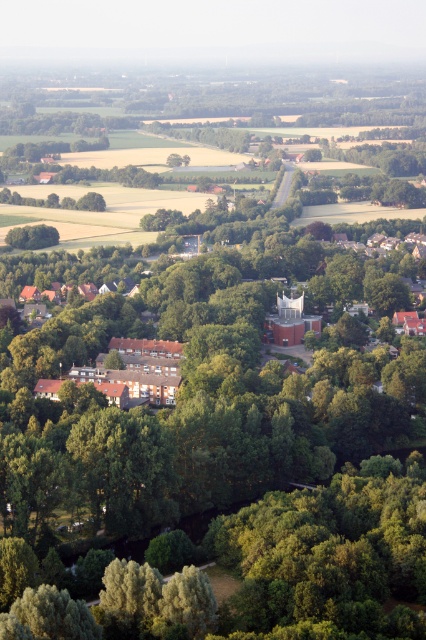
Is point (158, 360) positioned in front of point (37, 234)?

Yes, it is in front of point (37, 234).

Is brown wooden houses at lower left thinner than green leafy tree at lower left?

Incorrect, brown wooden houses at lower left's width is not less than green leafy tree at lower left's.

Who is more distant from viewer, (121, 369) or (14, 234)?

The point (14, 234) is behind.

The image size is (426, 640). In order to click on brown wooden houses at lower left in this screenshot , I will do [137, 371].